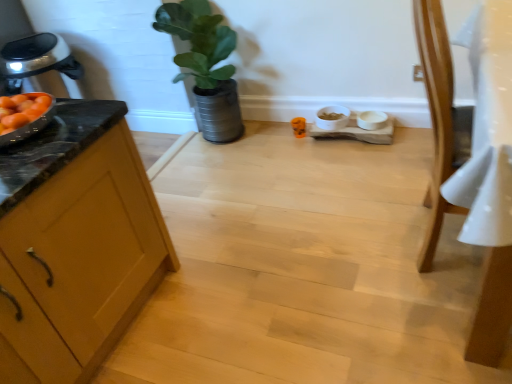
The height and width of the screenshot is (384, 512). In order to click on vacant space underneath light brown wooden chair at right (from a real-world perspective) in this screenshot , I will do click(440, 241).